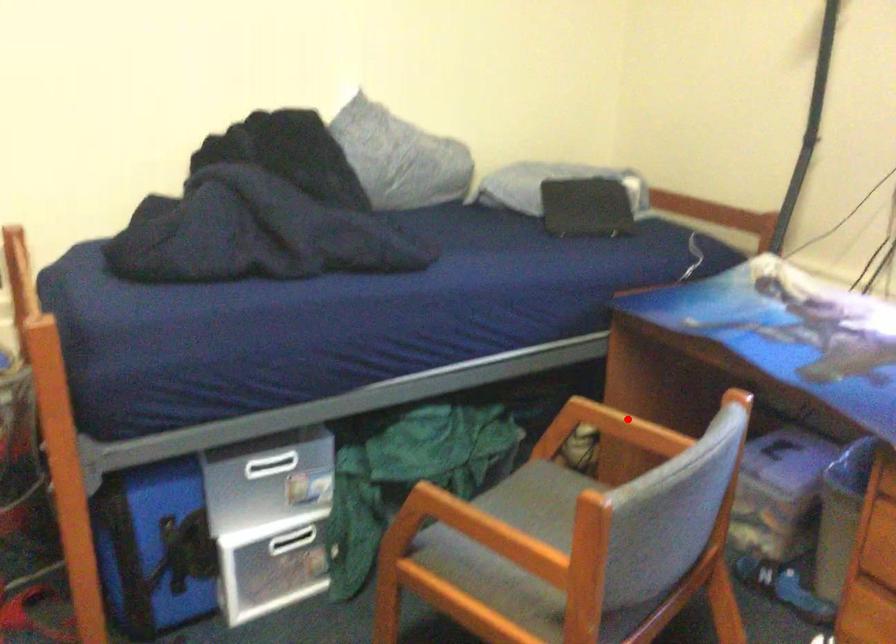
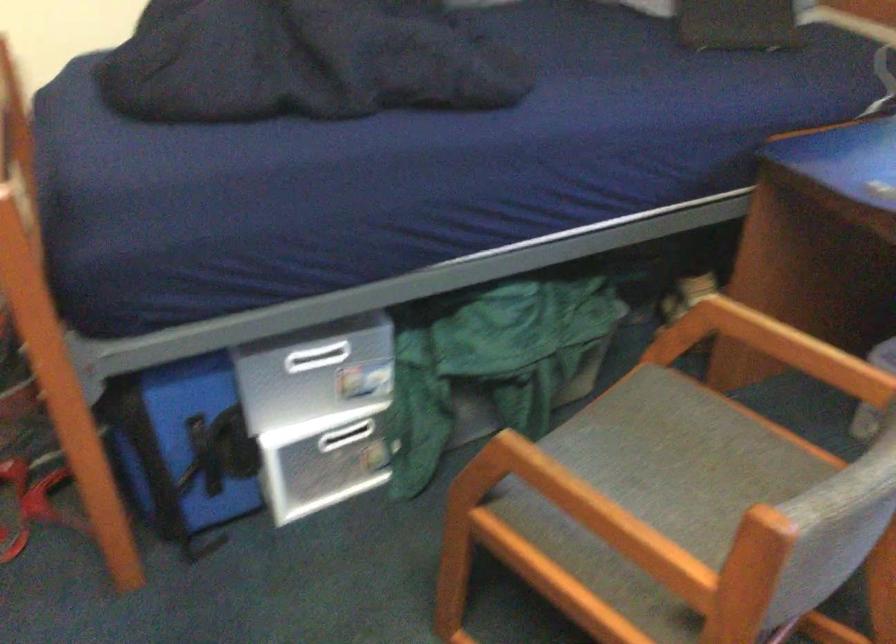
Locate, in the second image, the point that corresponds to the highlighted location in the first image.

(782, 328)